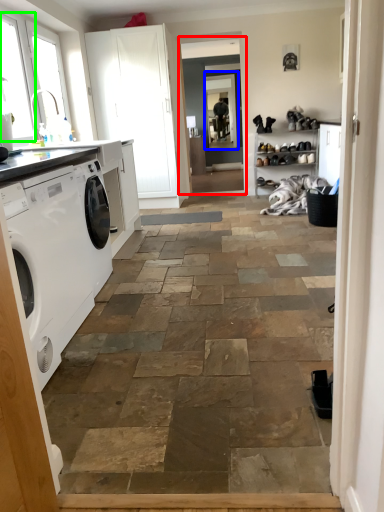
Question: Considering the real-world distances, which object is farthest from screen door (highlighted by a red box)? window screen (highlighted by a blue box) or window (highlighted by a green box)?

Choices:
 (A) window screen
 (B) window

Answer: (B)